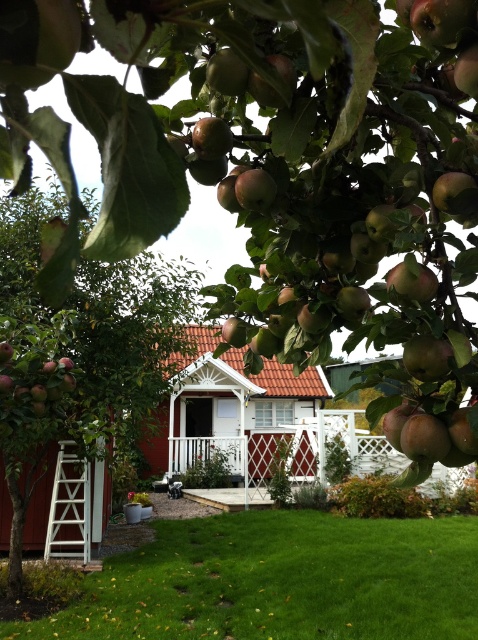
Question: Which point is closer to the camera taking this photo?

Choices:
 (A) (64, 490)
 (B) (65, 388)

Answer: (B)

Question: Which of the following is the closest to the observer?

Choices:
 (A) red wood barn at center
 (B) white wooden ladder at lower left

Answer: (B)

Question: Is green grass at lower center further to camera compared to white wooden ladder at lower left?

Choices:
 (A) yes
 (B) no

Answer: (A)

Question: Is green glossy apples at left behind shiny red apple at lower left?

Choices:
 (A) no
 (B) yes

Answer: (B)

Question: Can you confirm if green grass at lower center is smaller than shiny red apple at lower left?

Choices:
 (A) no
 (B) yes

Answer: (B)

Question: Estimate the real-world distances between objects in this image. Which object is farther from the green glossy apples at left?

Choices:
 (A) green grass at lower center
 (B) red wood barn at center
 (C) shiny red apple at lower left
 (D) white wooden ladder at lower left

Answer: (B)